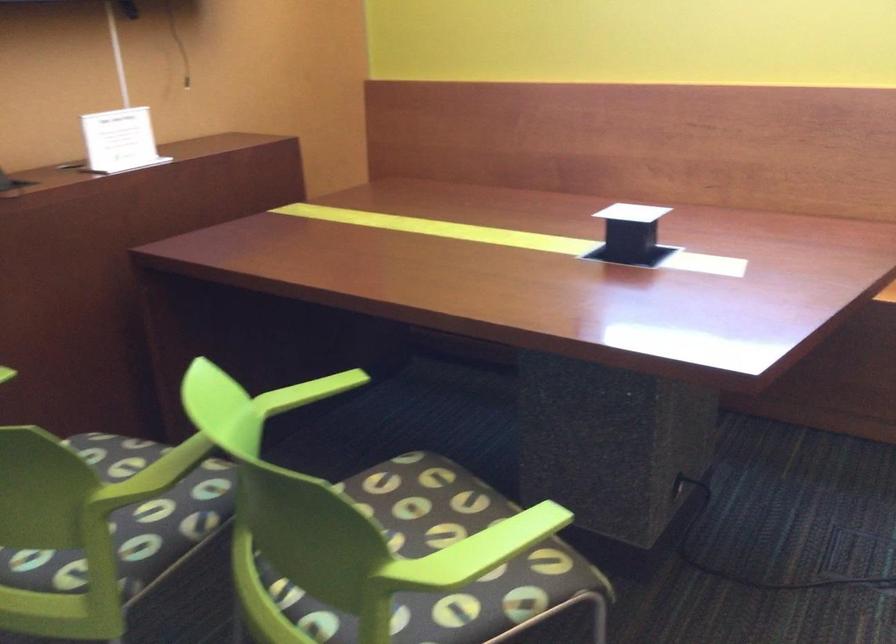
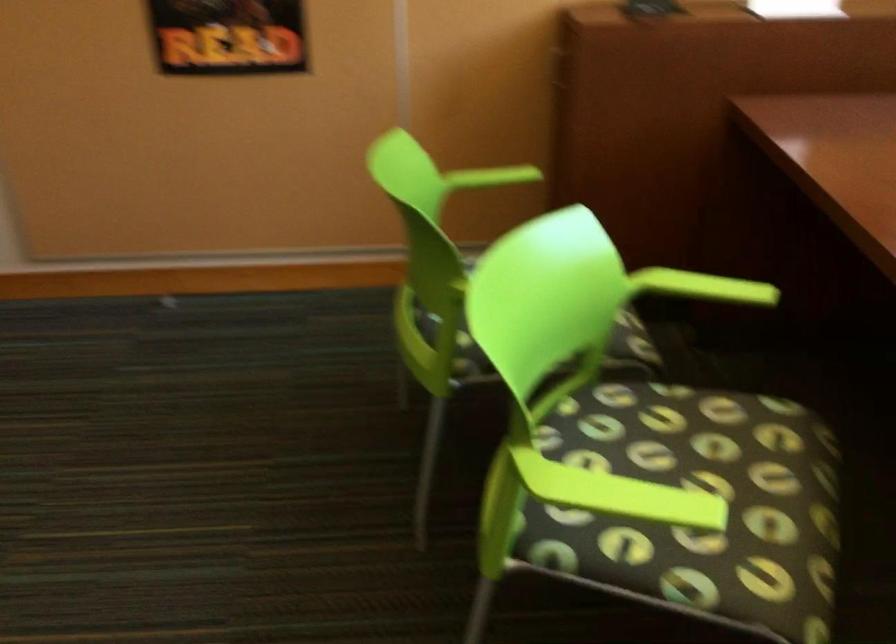
Looking at this image, the images are taken continuously from a first-person perspective. In which direction is your viewpoint rotating?

The camera rotated toward left-down.